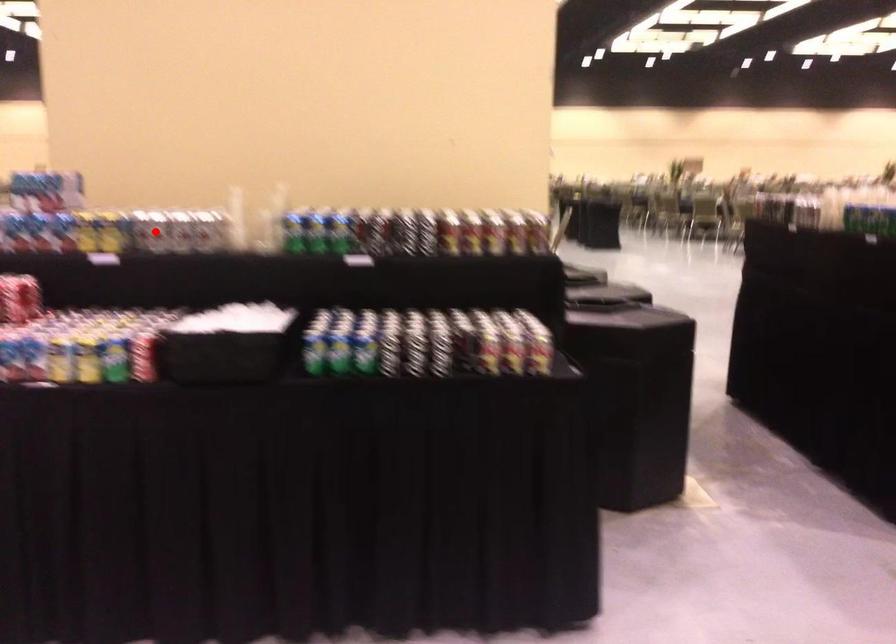
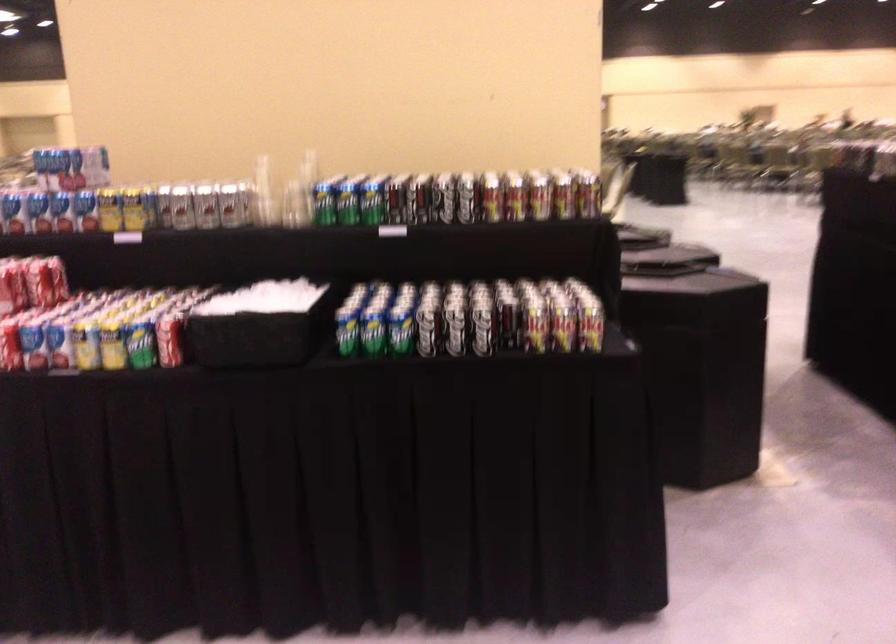
Question: I am providing you with two images of the same scene from different viewpoints. A red point is marked on the first image. Is the red point's position out of view in image 2?

Choices:
 (A) Yes
 (B) No

Answer: (B)